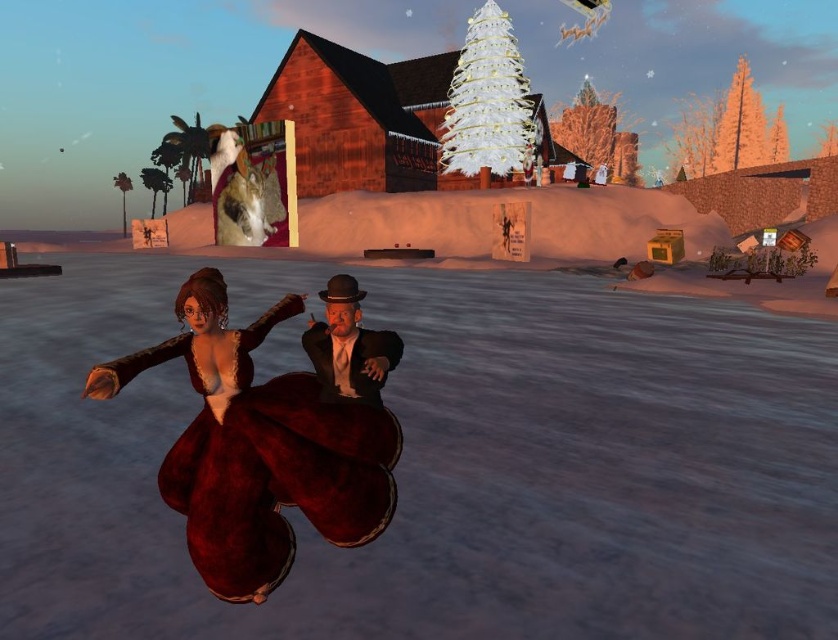
Can you confirm if white feathered christmas tree at upper center is bigger than shiny black suit at center?

Yes, white feathered christmas tree at upper center is bigger than shiny black suit at center.

Is point (473, 42) positioned behind point (391, 353)?

That is True.

The height and width of the screenshot is (640, 838). In order to click on white feathered christmas tree at upper center in this screenshot , I will do `click(489, 100)`.

Between velvet maroon dress at center and shiny black suit at center, which one is positioned lower?

velvet maroon dress at center

Between velvet maroon dress at center and shiny black suit at center, which one has more height?

With more height is velvet maroon dress at center.

Does point (109, 388) lie in front of point (345, 365)?

That is True.

You are a GUI agent. You are given a task and a screenshot of the screen. Output one action in this format:
    pyautogui.click(x=<x>, y=<y>)
    Task: Click on the velvet maroon dress at center
    
    Given the screenshot: What is the action you would take?
    pyautogui.click(x=260, y=449)

Who is lower down, velvet maroon dress at center or white feathered christmas tree at upper center?

velvet maroon dress at center

Is velvet maroon dress at center to the left of white feathered christmas tree at upper center from the viewer's perspective?

Yes, velvet maroon dress at center is to the left of white feathered christmas tree at upper center.

Is point (335, 422) positioned in front of point (453, 115)?

Yes.

The width and height of the screenshot is (838, 640). What are the coordinates of `velvet maroon dress at center` in the screenshot? It's located at (260, 449).